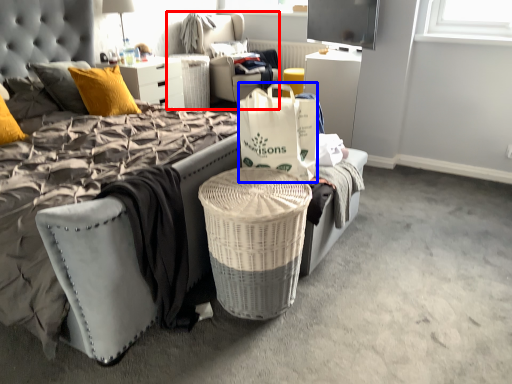
Question: Which object appears closest to the camera in this image, bean bag chair (highlighted by a red box) or box (highlighted by a blue box)?

Choices:
 (A) bean bag chair
 (B) box

Answer: (B)